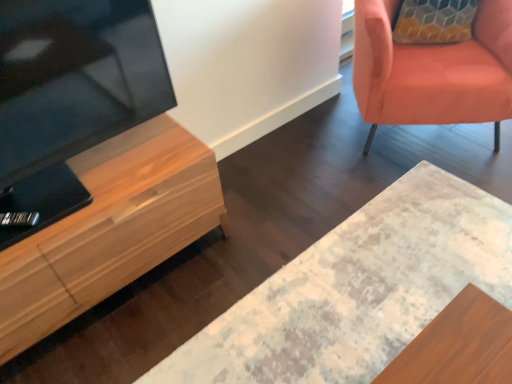
Image resolution: width=512 pixels, height=384 pixels. Find the location of `free point below matte wood television at left (from a real-world perspective)`. free point below matte wood television at left (from a real-world perspective) is located at coordinates (121, 151).